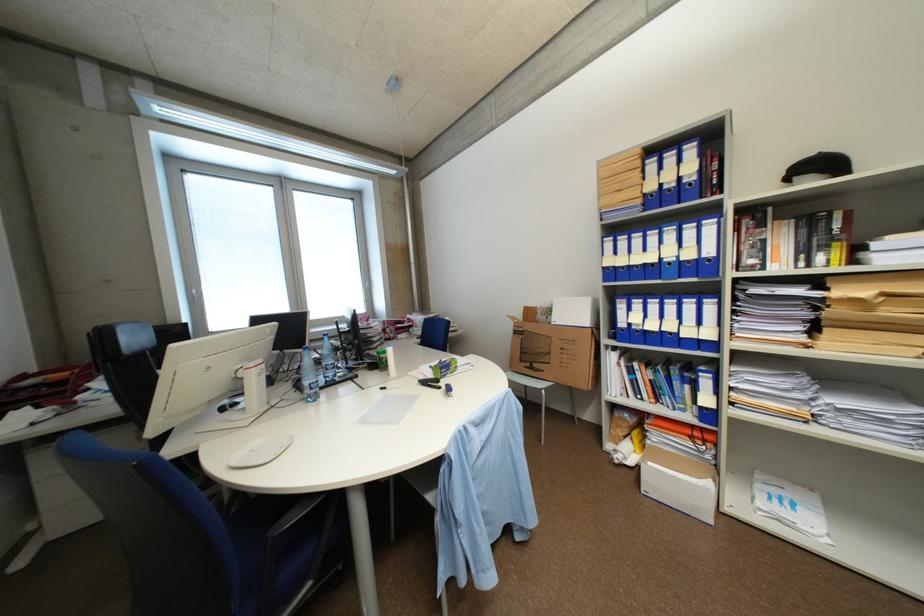
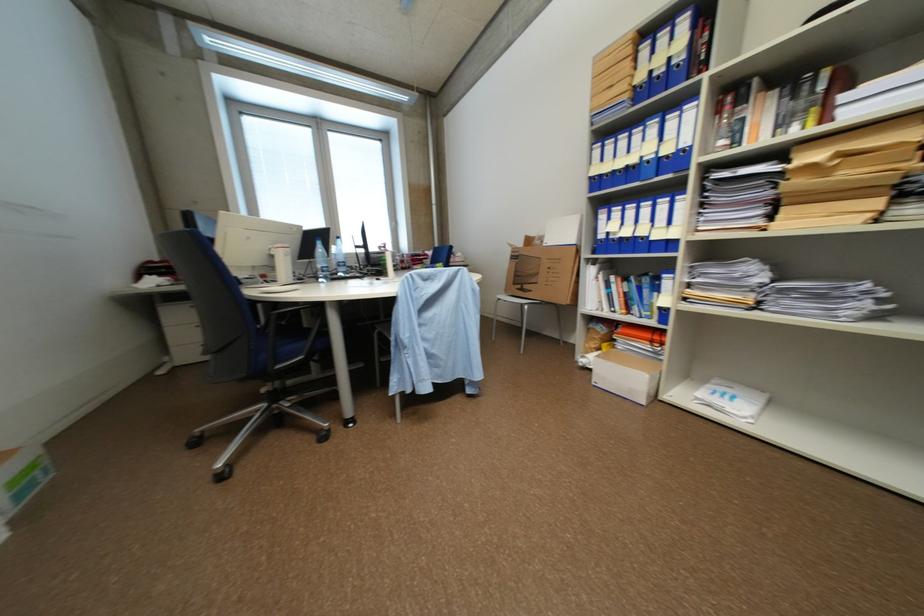
Locate, in the second image, the point that corresponds to [613,270] in the first image.

(600, 180)